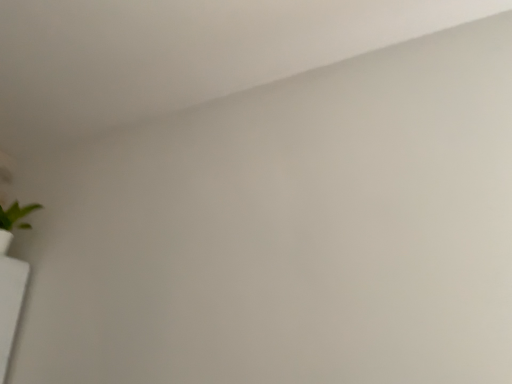
Describe the element at coordinates (13, 222) in the screenshot. I see `green leafy plant at lower left` at that location.

This screenshot has width=512, height=384. What are the coordinates of `green leafy plant at lower left` in the screenshot? It's located at (13, 222).

Locate an element on the screen. This screenshot has height=384, width=512. green leafy plant at lower left is located at coordinates (13, 222).